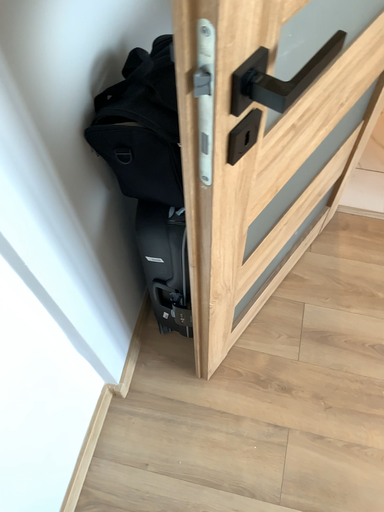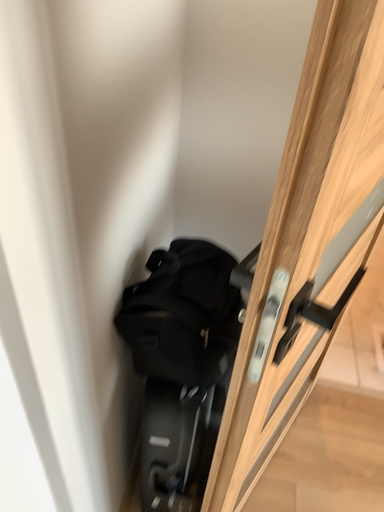
Question: How did the camera likely rotate when shooting the video?

Choices:
 (A) rotated left
 (B) rotated right

Answer: (B)